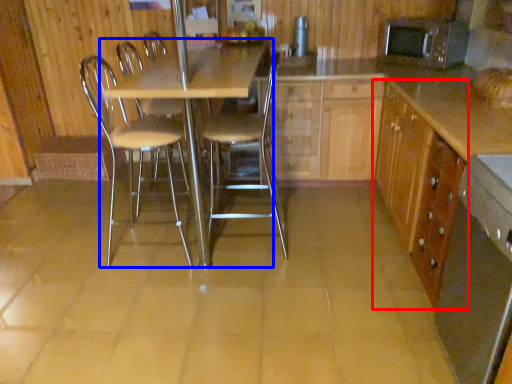
Question: Which point is closer to the camera, cabinetry (highlighted by a red box) or table (highlighted by a blue box)?

Choices:
 (A) cabinetry
 (B) table

Answer: (A)